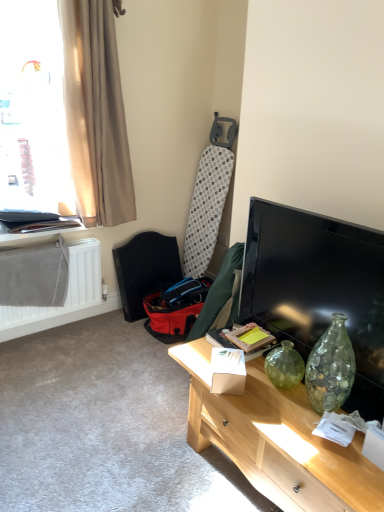
Question: Is red fabric swivel chair at lower left facing away from white matte radiator at lower left?

Choices:
 (A) yes
 (B) no

Answer: (B)

Question: From the image's perspective, is red fabric swivel chair at lower left under white matte radiator at lower left?

Choices:
 (A) no
 (B) yes

Answer: (A)

Question: Is white matte radiator at lower left surrounded by red fabric swivel chair at lower left?

Choices:
 (A) no
 (B) yes

Answer: (A)

Question: Does red fabric swivel chair at lower left appear on the right side of white matte radiator at lower left?

Choices:
 (A) yes
 (B) no

Answer: (A)

Question: Considering the relative sizes of red fabric swivel chair at lower left and white matte radiator at lower left in the image provided, is red fabric swivel chair at lower left bigger than white matte radiator at lower left?

Choices:
 (A) yes
 (B) no

Answer: (A)

Question: Is beige fabric curtain at upper left wider or thinner than matte black folder at upper left?

Choices:
 (A) wide
 (B) thin

Answer: (B)

Question: Considering their positions, is beige fabric curtain at upper left located in front of or behind matte black folder at upper left?

Choices:
 (A) behind
 (B) front

Answer: (B)

Question: From a real-world perspective, is beige fabric curtain at upper left positioned above or below matte black folder at upper left?

Choices:
 (A) above
 (B) below

Answer: (A)

Question: Is beige fabric curtain at upper left spatially inside matte black folder at upper left, or outside of it?

Choices:
 (A) outside
 (B) inside

Answer: (A)

Question: Choose the correct answer: Is red fabric swivel chair at lower left inside matte wooden desk at lower right or outside it?

Choices:
 (A) outside
 (B) inside

Answer: (A)

Question: Is red fabric swivel chair at lower left in front of or behind matte wooden desk at lower right in the image?

Choices:
 (A) front
 (B) behind

Answer: (B)

Question: Is point (178, 258) positioned closer to the camera than point (362, 440)?

Choices:
 (A) farther
 (B) closer

Answer: (A)

Question: Based on their sizes in the image, would you say red fabric swivel chair at lower left is bigger or smaller than matte wooden desk at lower right?

Choices:
 (A) big
 (B) small

Answer: (B)

Question: From the image's perspective, is matte black folder at upper left located above or below matte black tv at right?

Choices:
 (A) below
 (B) above

Answer: (B)

Question: Is point (28, 241) closer or farther from the camera than point (246, 252)?

Choices:
 (A) farther
 (B) closer

Answer: (A)